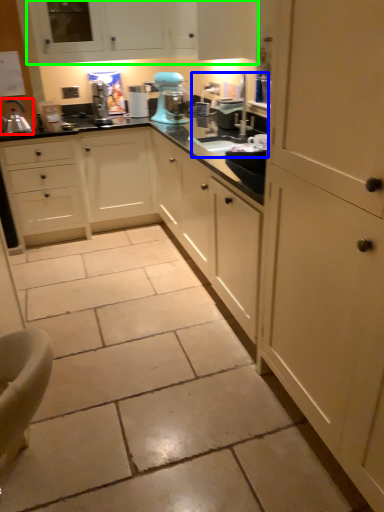
Question: Based on their relative distances, which object is farther from kitchen appliance (highlighted by a red box)? Choose from sink (highlighted by a blue box) and cabinetry (highlighted by a green box).

Choices:
 (A) sink
 (B) cabinetry

Answer: (A)